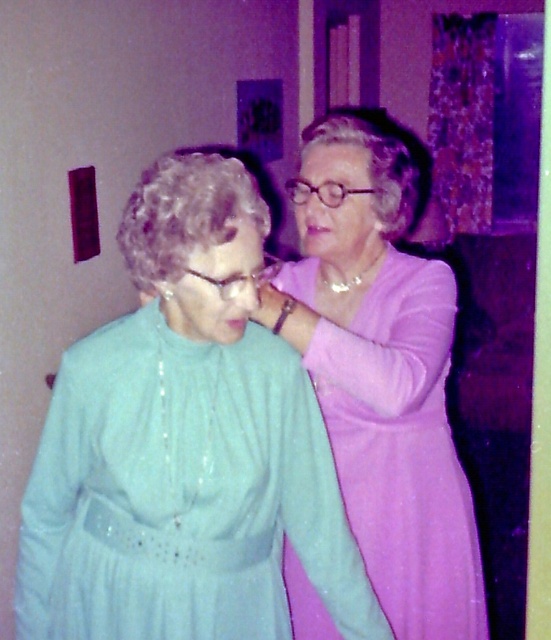
Between matte green dress at center and matte pink forehead at upper center, which one has more height?

With more height is matte green dress at center.

Between point (148, 630) and point (347, 168), which one is positioned behind?

The point (347, 168) is behind.

Between point (177, 604) and point (341, 164), which one is positioned in front?

Point (177, 604) is in front.

At what (x,y) coordinates should I click in order to perform the action: click on matte green dress at center. Please return your answer as a coordinate pair (x, y). This screenshot has height=640, width=551. Looking at the image, I should click on (182, 493).

Based on the photo, does matte green dress at center appear under matte purple dress at upper right?

Actually, matte green dress at center is above matte purple dress at upper right.

Between point (337, 548) and point (425, 556), which one is positioned behind?

Positioned behind is point (425, 556).

The width and height of the screenshot is (551, 640). I want to click on matte green dress at center, so click(x=182, y=493).

Who is lower down, matte purple dress at upper right or matte pink forehead at upper center?

matte purple dress at upper right

Consider the image. Is matte purple dress at upper right smaller than matte pink forehead at upper center?

Incorrect, matte purple dress at upper right is not smaller in size than matte pink forehead at upper center.

Which is in front, point (417, 422) or point (359, 168)?

Point (359, 168) is in front.

Locate an element on the screen. matte purple dress at upper right is located at coordinates (402, 449).